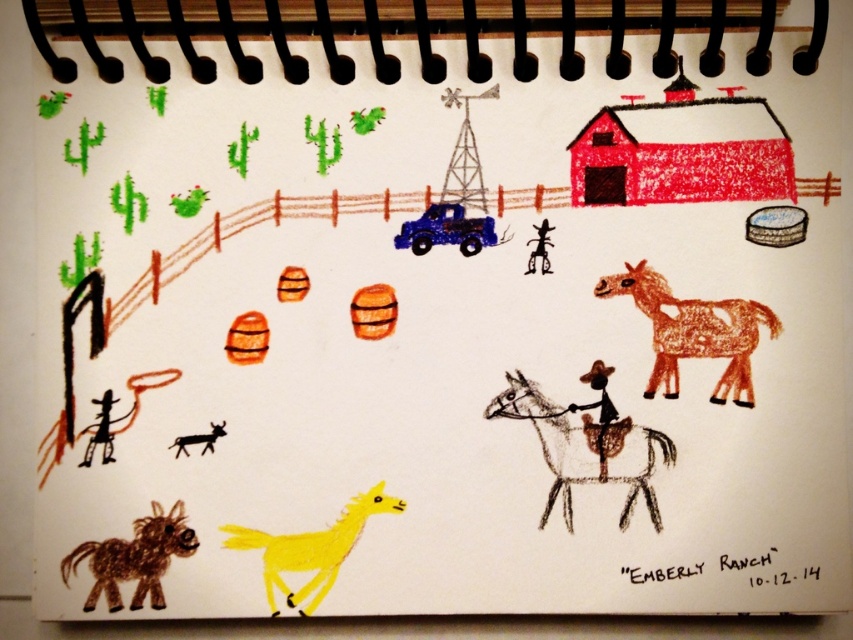
You are standing at the bottom right corner of the notebook page where the label is. Which direction should you look to see the yellow matte horse at lower left?

The yellow matte horse at lower left is located at point (311, 548), so you should look towards the lower left direction from the bottom right corner to see it.